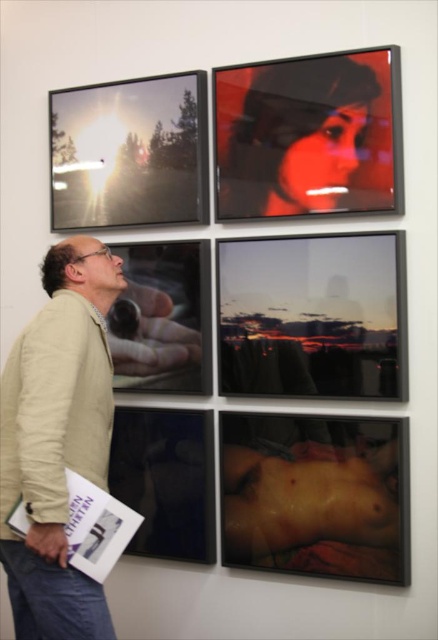
Question: Can you confirm if smooth skin at lower right is thinner than black glass picture frame at lower left?

Choices:
 (A) yes
 (B) no

Answer: (B)

Question: Which object is the farthest from the black glass picture frame at lower left?

Choices:
 (A) metallic reflective screen at upper left
 (B) beige cotton jacket at lower left
 (C) matte black portrait at upper center

Answer: (C)

Question: Which object appears closest to the camera in this image?

Choices:
 (A) matte black portrait at upper center
 (B) matte black hand at center
 (C) beige cotton jacket at lower left
 (D) matte glass sunset at center

Answer: (C)

Question: Considering the real-world distances, which object is farthest from the matte glass sunset at center?

Choices:
 (A) black glass picture frame at lower left
 (B) smooth skin at lower right
 (C) beige cotton jacket at lower left
 (D) matte black portrait at upper center

Answer: (C)

Question: Is matte glass sunset at center to the left of black glass picture frame at lower left from the viewer's perspective?

Choices:
 (A) yes
 (B) no

Answer: (B)

Question: Is beige cotton jacket at lower left thinner than black glass picture frame at lower left?

Choices:
 (A) no
 (B) yes

Answer: (B)